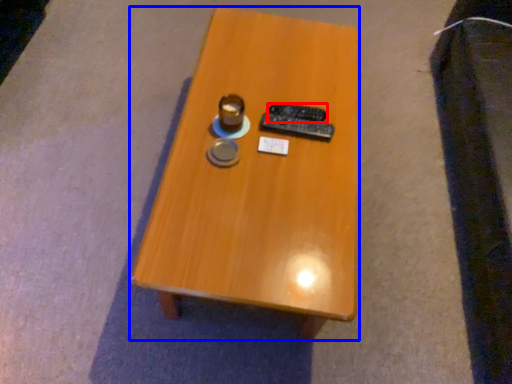
Question: Which object appears farthest to the camera in this image, remote control (highlighted by a red box) or table (highlighted by a blue box)?

Choices:
 (A) remote control
 (B) table

Answer: (A)